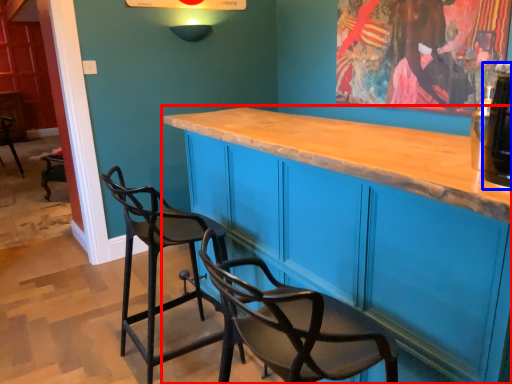
Question: Among these objects, which one is farthest to the camera, cabinetry (highlighted by a red box) or beverage (highlighted by a blue box)?

Choices:
 (A) cabinetry
 (B) beverage

Answer: (B)